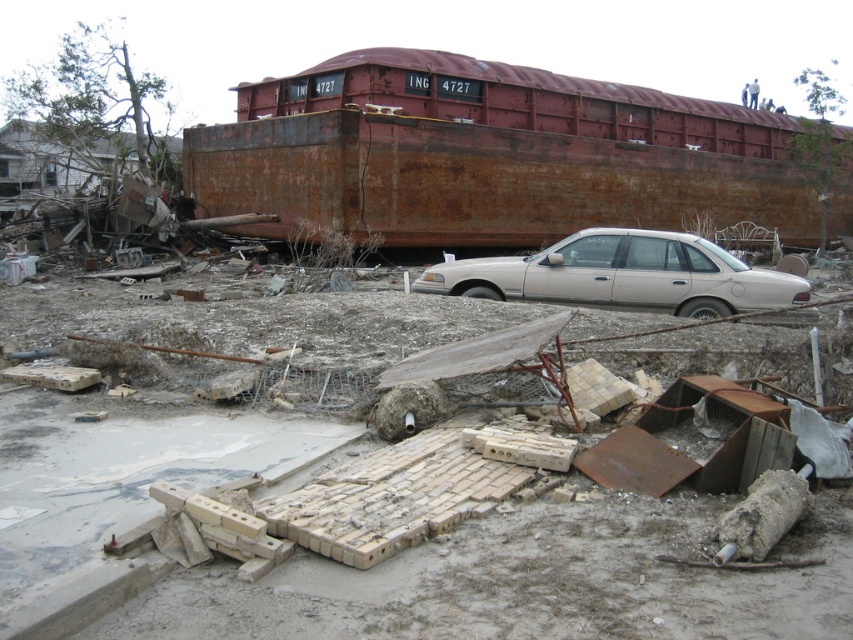
Question: Which point is closer to the camera?

Choices:
 (A) rusty metal debris at center
 (B) rusty metal train car at upper center

Answer: (A)

Question: Does rusty metal debris at center appear over white matte sedan at center?

Choices:
 (A) no
 (B) yes

Answer: (A)

Question: Estimate the real-world distances between objects in this image. Which object is farther from the rusty metal debris at center?

Choices:
 (A) rusty metal train car at upper center
 (B) white matte sedan at center

Answer: (A)

Question: Considering the relative positions of rusty metal debris at center and white matte sedan at center in the image provided, where is rusty metal debris at center located with respect to white matte sedan at center?

Choices:
 (A) right
 (B) left

Answer: (B)

Question: Is rusty metal debris at center to the left of white matte sedan at center from the viewer's perspective?

Choices:
 (A) no
 (B) yes

Answer: (B)

Question: Based on their relative distances, which object is nearer to the rusty metal debris at center?

Choices:
 (A) white matte sedan at center
 (B) rusty metal train car at upper center

Answer: (A)